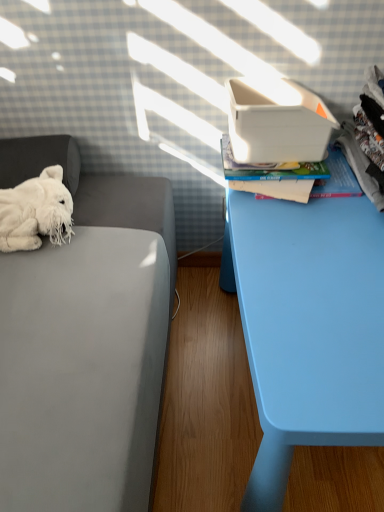
The height and width of the screenshot is (512, 384). I want to click on light blue plastic table at right, so click(x=308, y=327).

What do you see at coordinates (301, 173) in the screenshot? I see `hardcover book at upper right` at bounding box center [301, 173].

What do you see at coordinates (85, 339) in the screenshot?
I see `white plush toy at left` at bounding box center [85, 339].

Where is `light blue plastic table at right`? The image size is (384, 512). light blue plastic table at right is located at coordinates (308, 327).

In terms of height, does white plastic shoe box at upper right look taller or shorter compared to light blue plastic table at right?

Considering their sizes, white plastic shoe box at upper right has less height than light blue plastic table at right.

Is white plastic shoe box at upper right spatially inside light blue plastic table at right, or outside of it?

white plastic shoe box at upper right exists outside the volume of light blue plastic table at right.

Would you consider white plastic shoe box at upper right to be distant from light blue plastic table at right?

Actually, white plastic shoe box at upper right and light blue plastic table at right are a little close together.

Which of these two, white plush toy at left or white fluffy stuffed animal at left, is wider?

Wider between the two is white plush toy at left.

Which object is positioned more to the right, white plush toy at left or white fluffy stuffed animal at left?

white plush toy at left is more to the right.

Which of these two, white plastic shoe box at upper right or white plush toy at left, is thinner?

white plastic shoe box at upper right is thinner.

Consider the image. Could you tell me if white plastic shoe box at upper right is turned towards white plush toy at left?

No.

Is white plastic shoe box at upper right bigger or smaller than white plush toy at left?

Clearly, white plastic shoe box at upper right is smaller in size than white plush toy at left.

Locate an element on the screen. The image size is (384, 512). shoe box above the white plush toy at left (from a real-world perspective) is located at coordinates (277, 124).

From their relative heights in the image, would you say white fluffy stuffed animal at left is taller or shorter than light blue plastic table at right?

Clearly, white fluffy stuffed animal at left is shorter compared to light blue plastic table at right.

In the scene shown: Is white fluffy stuffed animal at left inside the boundaries of light blue plastic table at right, or outside?

white fluffy stuffed animal at left lies outside light blue plastic table at right.

From the picture: From a real-world perspective, is white fluffy stuffed animal at left positioned over light blue plastic table at right based on gravity?

Yes.

Can hardcover book at upper right be found inside white plastic shoe box at upper right?

No, hardcover book at upper right is not a part of white plastic shoe box at upper right.

From a real-world perspective, is white plastic shoe box at upper right positioned above or below hardcover book at upper right?

In terms of real-world spatial position, white plastic shoe box at upper right is above hardcover book at upper right.

Which of these two, white plastic shoe box at upper right or hardcover book at upper right, is smaller?

hardcover book at upper right.

From the image's perspective, is white plastic shoe box at upper right located above or below hardcover book at upper right?

Clearly, from the image's perspective, white plastic shoe box at upper right is above hardcover book at upper right.

From the image's perspective, which is below, light blue plastic table at right or white fluffy stuffed animal at left?

light blue plastic table at right, from the image's perspective.

Considering the points (326, 332) and (53, 169), which point is behind, point (326, 332) or point (53, 169)?

The point (53, 169) is farther.

Which is in front, light blue plastic table at right or white fluffy stuffed animal at left?

light blue plastic table at right is closer to the camera.

Is light blue plastic table at right facing away from hardcover book at upper right?

No, hardcover book at upper right is not at the back of light blue plastic table at right.

Based on the photo, is light blue plastic table at right not near hardcover book at upper right?

No, there isn't a large distance between light blue plastic table at right and hardcover book at upper right.

This screenshot has width=384, height=512. In order to click on shoe box on the left of light blue plastic table at right in this screenshot , I will do `click(277, 124)`.

The width and height of the screenshot is (384, 512). I want to click on furniture that appears below the white fluffy stuffed animal at left (from a real-world perspective), so click(x=85, y=339).

When comparing their distances from white plush toy at left, does hardcover book at upper right or white fluffy stuffed animal at left seem further?

hardcover book at upper right is positioned further to the anchor white plush toy at left.

Considering their positions, is white plush toy at left positioned further to hardcover book at upper right than white plastic shoe box at upper right?

white plush toy at left lies further to hardcover book at upper right than the other object.

Which object lies further to the anchor point hardcover book at upper right, white plastic shoe box at upper right or white plush toy at left?

Among the two, white plush toy at left is located further to hardcover book at upper right.

Looking at this image, when comparing their distances from hardcover book at upper right, does light blue plastic table at right or white plastic shoe box at upper right seem further?

light blue plastic table at right lies further to hardcover book at upper right than the other object.

Looking at the image, which one is located further to white fluffy stuffed animal at left, white plastic shoe box at upper right or white plush toy at left?

white plastic shoe box at upper right lies further to white fluffy stuffed animal at left than the other object.

When comparing their distances from light blue plastic table at right, does white plastic shoe box at upper right or hardcover book at upper right seem further?

white plastic shoe box at upper right lies further to light blue plastic table at right than the other object.

Based on their spatial positions, is white fluffy stuffed animal at left or white plastic shoe box at upper right closer to white plush toy at left?

white fluffy stuffed animal at left lies closer to white plush toy at left than the other object.

Which object lies further to the anchor point white fluffy stuffed animal at left, hardcover book at upper right or white plastic shoe box at upper right?

white plastic shoe box at upper right lies further to white fluffy stuffed animal at left than the other object.

Where is `furniture between white fluffy stuffed animal at left and white plastic shoe box at upper right from left to right`? furniture between white fluffy stuffed animal at left and white plastic shoe box at upper right from left to right is located at coordinates (85, 339).

This screenshot has height=512, width=384. What are the coordinates of `shoe box between white plush toy at left and hardcover book at upper right` in the screenshot? It's located at (277, 124).

This screenshot has width=384, height=512. I want to click on furniture located between white fluffy stuffed animal at left and hardcover book at upper right in the left-right direction, so click(x=85, y=339).

Where is `shoe box between white fluffy stuffed animal at left and hardcover book at upper right from left to right`? shoe box between white fluffy stuffed animal at left and hardcover book at upper right from left to right is located at coordinates (277, 124).